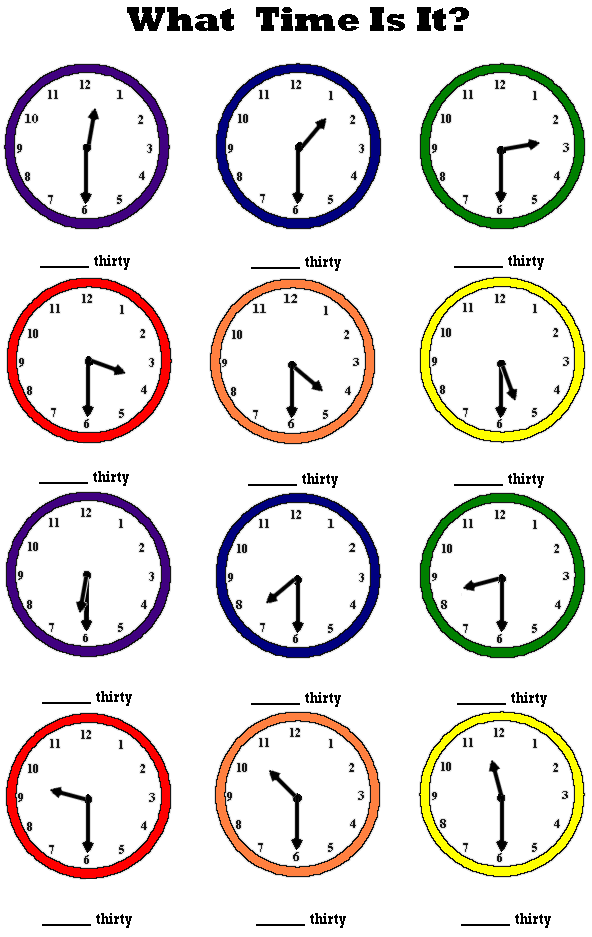
The image size is (592, 937). I want to click on red clock, so click(96, 332), click(106, 753).